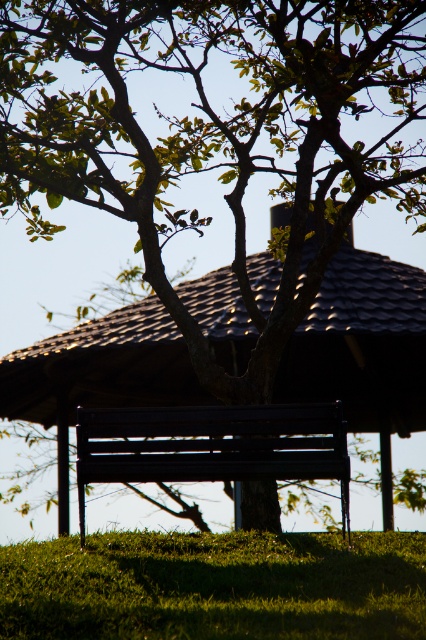
You are standing on the green grassy at lower center and want to sit on the matte black bench at center. Which direction should you move to reach the bench?

The matte black bench at center is behind the green grassy at lower center, so you should move backward to reach it.

You are planning to set up a small picnic area in the scene. Considering the space available, which object from the green grassy at lower center and the matte black bench at center would be more suitable for placing a picnic blanket?

The matte black bench at center occupies more space than the green grassy at lower center, so the matte black bench at center would be more suitable for placing a picnic blanket due to its larger area.

You are standing in the outdoor scene and want to place a small statue between the two points, point (279, 538) and point (342, 481). Which point should the statue be closer to if you want it to be more visible to someone approaching from the front?

The statue should be placed closer to point (279, 538) because it is further to the camera than point (342, 481), making it more visible to someone approaching from the front.